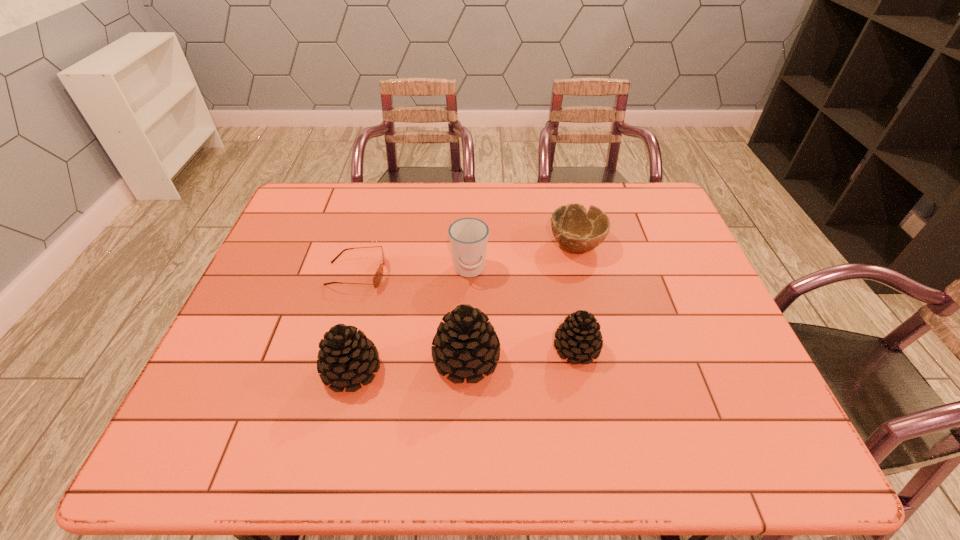
Identify the location of blank area located on the front-facing side of the shortest object. (464, 274).

Locate an element on the screen. This screenshot has height=540, width=960. free space located with a handle on the side of the cup is located at coordinates (468, 308).

This screenshot has height=540, width=960. I want to click on vacant space at the far edge of the desktop, so click(x=464, y=200).

Image resolution: width=960 pixels, height=540 pixels. In the image, there is a desktop. In order to click on vacant space at the near edge in this screenshot , I will do `click(309, 389)`.

Where is `vacant position at the left edge of the desktop`? The width and height of the screenshot is (960, 540). vacant position at the left edge of the desktop is located at coordinates (253, 291).

In the image, there is a desktop. Identify the location of free region at the right edge. (695, 268).

Where is `vacant space at the far left corner`? This screenshot has width=960, height=540. vacant space at the far left corner is located at coordinates (323, 219).

Locate an element on the screen. free space between the cup and the leftmost pinecone is located at coordinates (411, 320).

Identify the location of free space between the second pinecone from left to right and the rightmost pinecone. The image size is (960, 540). (521, 354).

At what (x,y) coordinates should I click in order to perform the action: click on vacant area between the second tallest pinecone and the sunglasses. Please return your answer as a coordinate pair (x, y). This screenshot has width=960, height=540. Looking at the image, I should click on (354, 322).